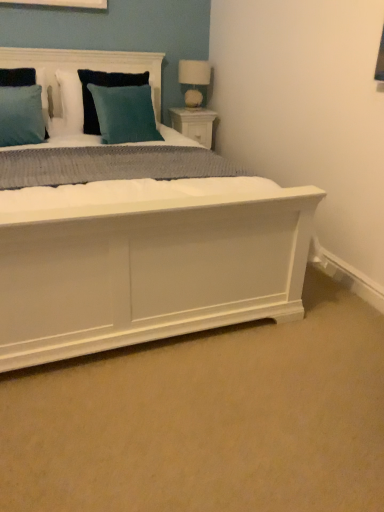
Question: Should I look upward or downward to see teal velvet pillow at upper center, which is counted as the 2th pillow, starting from the front?

Choices:
 (A) up
 (B) down

Answer: (A)

Question: Is white fabric lampshade at upper right oriented away from teal fabric pillow at upper center?

Choices:
 (A) no
 (B) yes

Answer: (A)

Question: From a real-world perspective, is white fabric lampshade at upper right positioned under teal fabric pillow at upper center based on gravity?

Choices:
 (A) no
 (B) yes

Answer: (A)

Question: Is white fabric lampshade at upper right facing towards teal fabric pillow at upper center?

Choices:
 (A) no
 (B) yes

Answer: (A)

Question: Can you confirm if white fabric lampshade at upper right is bigger than teal fabric pillow at upper center?

Choices:
 (A) yes
 (B) no

Answer: (B)

Question: Can you confirm if white fabric lampshade at upper right is positioned to the left of teal fabric pillow at upper center?

Choices:
 (A) no
 (B) yes

Answer: (A)

Question: From the image's perspective, is white fabric lampshade at upper right under teal fabric pillow at upper center?

Choices:
 (A) no
 (B) yes

Answer: (A)

Question: Is white wood nightstand at upper right further to camera compared to teal velvet pillow at upper center, which appears as the second pillow when viewed from the back?

Choices:
 (A) no
 (B) yes

Answer: (B)

Question: Is white wood nightstand at upper right facing towards teal velvet pillow at upper center, which is counted as the 2th pillow, starting from the front?

Choices:
 (A) no
 (B) yes

Answer: (A)

Question: Is white wood nightstand at upper right facing away from teal velvet pillow at upper center, which is counted as the 2th pillow, starting from the front?

Choices:
 (A) yes
 (B) no

Answer: (B)

Question: From the image's perspective, does white wood nightstand at upper right appear higher than teal velvet pillow at upper center, which appears as the second pillow when viewed from the back?

Choices:
 (A) yes
 (B) no

Answer: (A)

Question: Is teal velvet pillow at upper center, which is counted as the 2th pillow, starting from the front, located within white wood nightstand at upper right?

Choices:
 (A) no
 (B) yes

Answer: (A)

Question: Are white wood nightstand at upper right and teal velvet pillow at upper center, which is counted as the 2th pillow, starting from the front, beside each other?

Choices:
 (A) yes
 (B) no

Answer: (B)

Question: From the image's perspective, is teal fabric pillow at upper center, arranged as the first pillow when viewed from the back, on white wood nightstand at upper right?

Choices:
 (A) yes
 (B) no

Answer: (A)